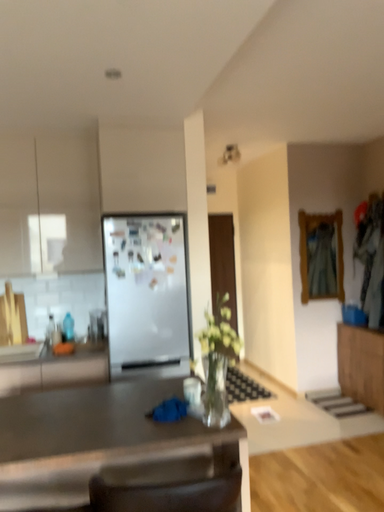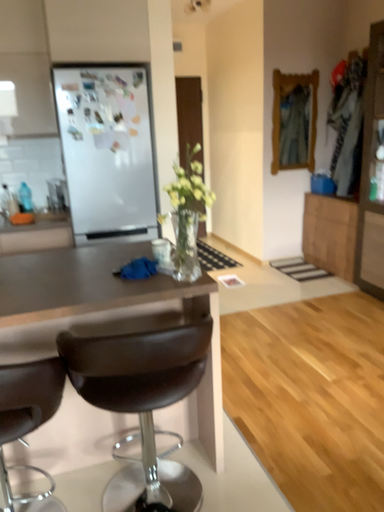
Question: How did the camera likely rotate when shooting the video?

Choices:
 (A) rotated upward
 (B) rotated downward

Answer: (B)